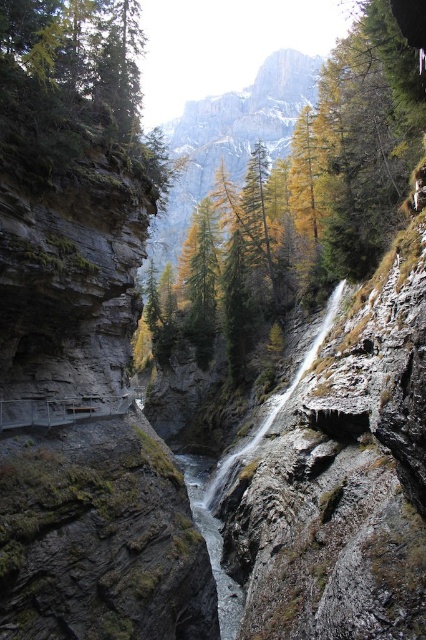
You are a hiker who wants to cross the canyon using the metal railing on the left. You see the golden larch trees at upper center and the clear water at center. Which object is taller and could potentially block your view when looking upwards?

The golden larch trees at upper center is much taller than the clear water at center, so it could block your view when looking upwards.

You are a hiker standing at the viewing platform near the metal railing on the left side of the canyon. You want to take a photo that includes both the golden larch trees at upper center and the clear water at center. Which object should you zoom in on to ensure both are in the frame?

You should zoom in on the clear water at center because the golden larch trees at upper center are bigger than the clear water at center, so focusing on the smaller object will help include both in the frame.

You are standing at the viewing platform near the metal railing on the left side of the canyon. You want to take a photo of the golden larch trees at upper center located at point (x=230, y=138). Which direction should you face to capture them in your shot?

You should face towards the upper center direction to capture the golden larch trees at upper center located at point (x=230, y=138) in your photo.